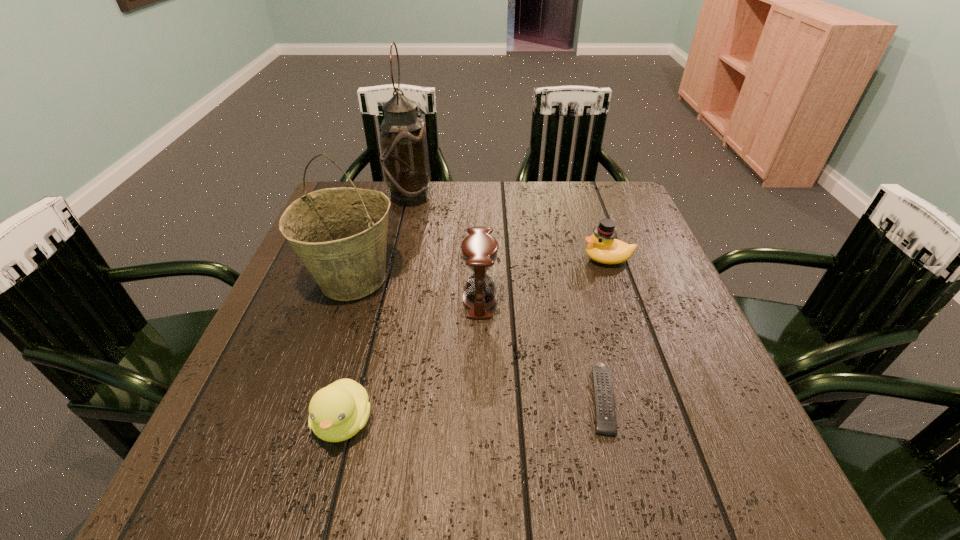
Where is `free region located 0.110m on the right of the wine bucket`? free region located 0.110m on the right of the wine bucket is located at coordinates (446, 280).

Where is `vacant space located 0.300m on the front of the third tallest object`? vacant space located 0.300m on the front of the third tallest object is located at coordinates (480, 457).

Identify the location of free space located 0.400m on the front-facing side of the rightmost object. This screenshot has height=540, width=960. pyautogui.click(x=420, y=259).

I want to click on blank space located 0.080m on the front-facing side of the rightmost object, so click(x=549, y=259).

What are the coordinates of `vacant space located on the front-facing side of the rightmost object` in the screenshot? It's located at (533, 259).

This screenshot has height=540, width=960. Identify the location of vacant space situated 0.070m at the beak of the duckling. (324, 500).

The image size is (960, 540). In order to click on vacant space positioned on the left of the shortest object in this screenshot , I will do `click(436, 399)`.

Identify the location of object at the far edge. (404, 157).

The width and height of the screenshot is (960, 540). Identify the location of object that is at the near edge. (337, 412).

Find the location of a particular element. This screenshot has width=960, height=540. object positioned at the left edge is located at coordinates (340, 234).